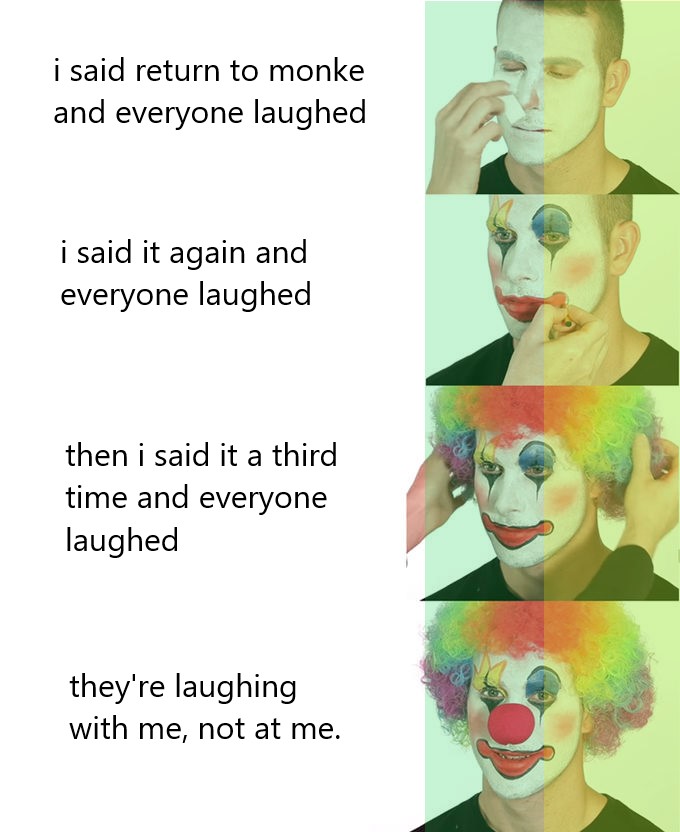
In order to click on text panels in this screenshot , I will do `click(232, 125)`, `click(194, 278)`, `click(218, 478)`, `click(209, 743)`.